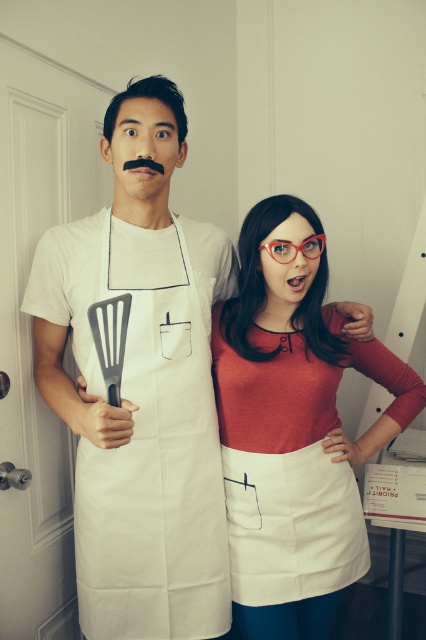
You are standing in a kitchen and see a point marked at coordinates point (331, 320). If you want to place a 1.5 meter tall cake stand on the floor, will the point be within the stand? Please explain your reasoning based on the distance from the viewer.

The point (331, 320) is 1.46 meters from the viewer. Since the cake stand is 1.5 meters tall, the point is slightly closer than the height of the stand. Therefore, the point would be within the stand if it were placed on the floor.

From the picture: You are a photographer setting up for a photo shoot. You need to ensure that the two aprons, the matte white apron at center and the white fabric apron at left, are spaced exactly 6 inches apart for proper lighting. Based on the scene, will you need to move them closer or farther apart?

The distance between the matte white apron at center and the white fabric apron at left is currently 6.49 inches. Since 6.49 inches is slightly more than 6 inches, you would need to move them closer together to achieve the desired spacing of 6 inches.